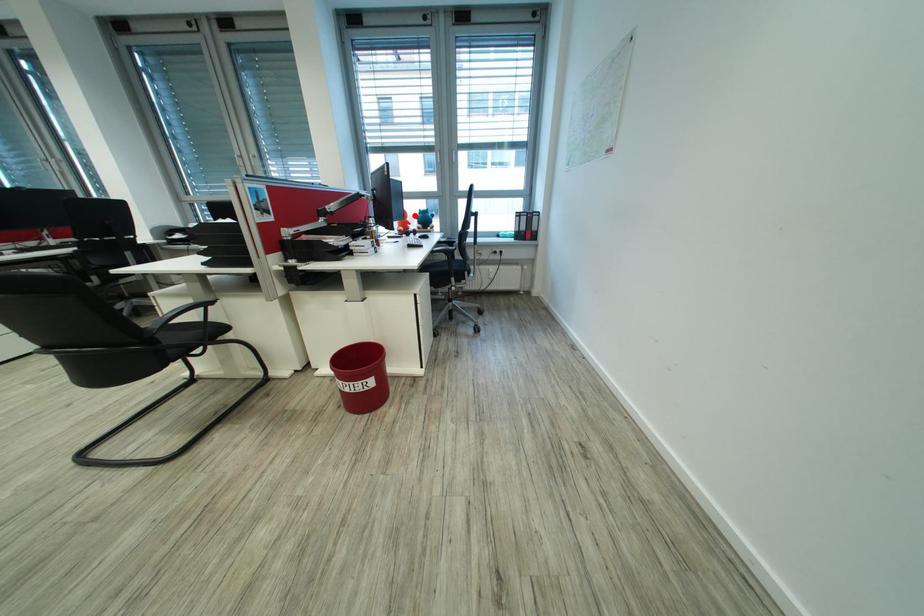
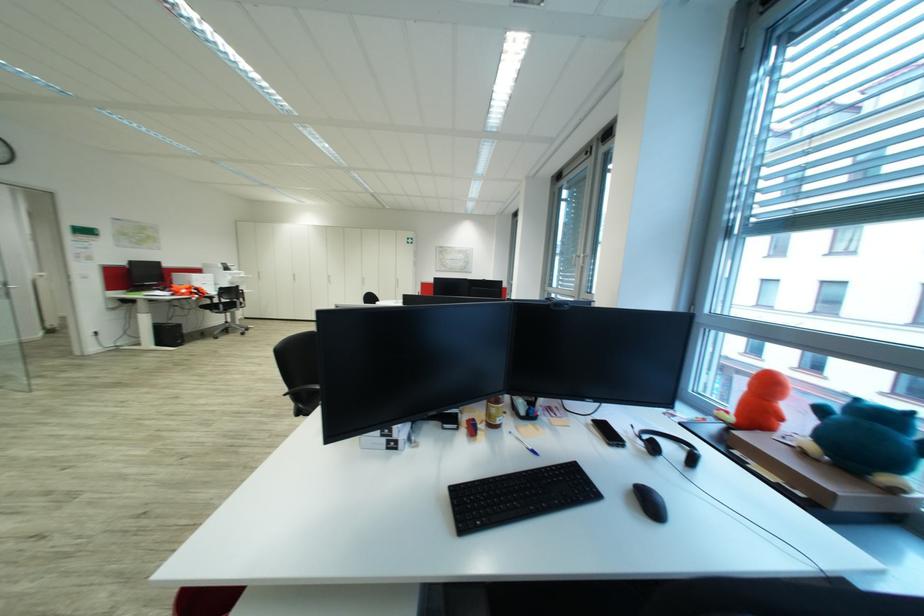
In the second image, find the point that corresponds to the highlighted location in the first image.

(821, 410)